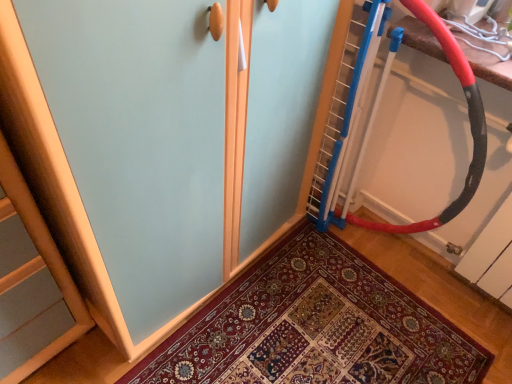
This screenshot has height=384, width=512. Find the location of `vacant area that is in front of red rubber garden hose at right`. vacant area that is in front of red rubber garden hose at right is located at coordinates (366, 314).